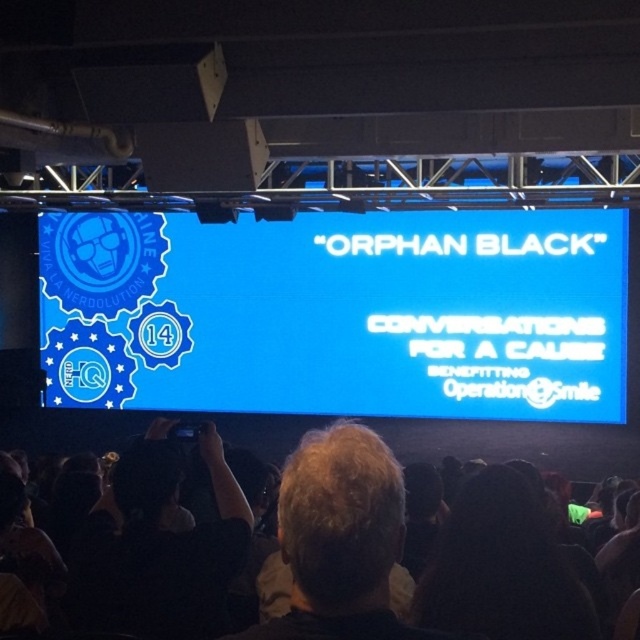
Question: Is blue glossy screen at upper center above blonde hair at center?

Choices:
 (A) yes
 (B) no

Answer: (A)

Question: Is blue glossy screen at upper center below black fabric camera at lower left?

Choices:
 (A) yes
 (B) no

Answer: (B)

Question: Which point appears farthest from the camera in this image?

Choices:
 (A) (346, 605)
 (B) (48, 428)
 (C) (289, 358)

Answer: (B)

Question: Which object is the closest to the black fabric camera at lower left?

Choices:
 (A) black fabric at lower center
 (B) blue glossy screen at upper center
 (C) blonde hair at center

Answer: (C)

Question: Can you confirm if dark hair at center is positioned below black fabric at lower center?

Choices:
 (A) yes
 (B) no

Answer: (B)

Question: Estimate the real-world distances between objects in this image. Which object is farther from the blue glossy screen at upper center?

Choices:
 (A) dark hair at center
 (B) blonde hair at center
 (C) black fabric camera at lower left

Answer: (B)